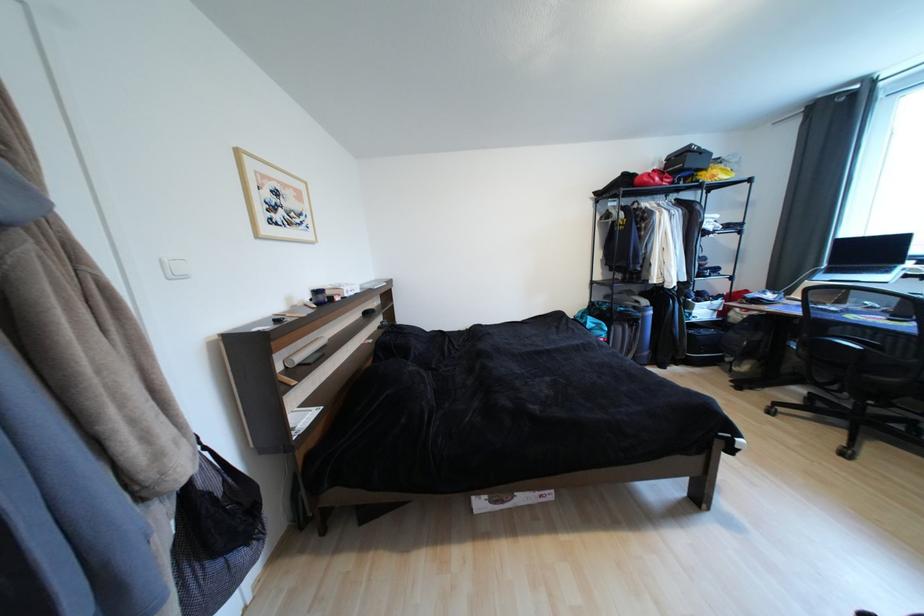
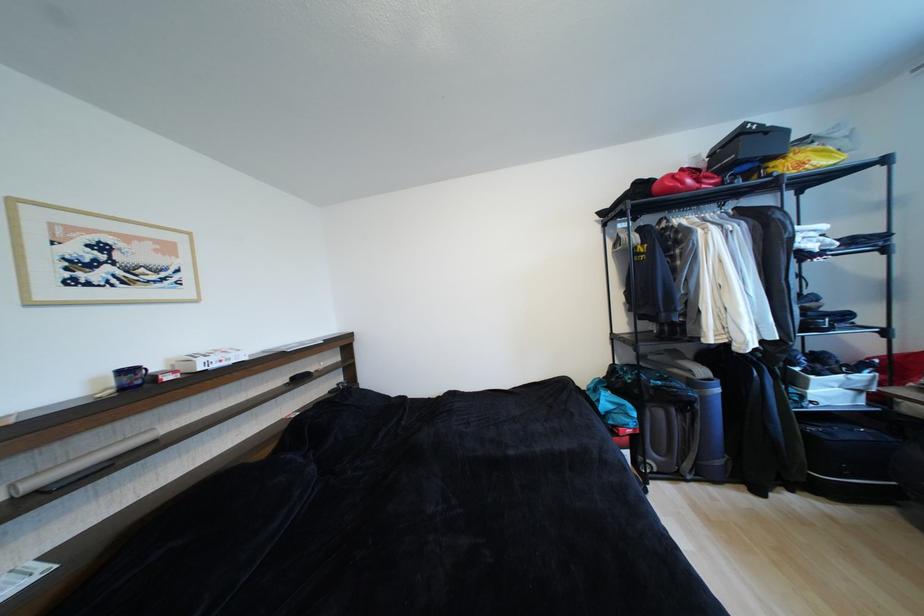
Locate, in the second image, the point that corresponds to (x=651, y=185) in the first image.

(676, 192)